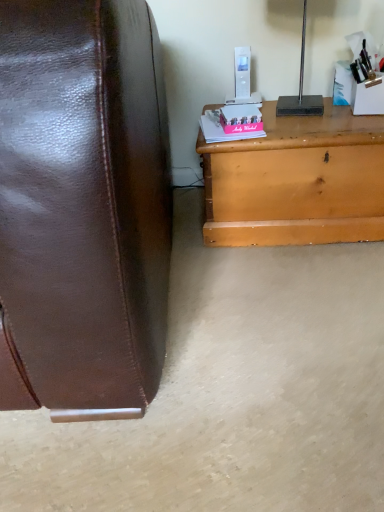
Where is `empty space that is ontop of wooden nightstand at right`? Image resolution: width=384 pixels, height=512 pixels. empty space that is ontop of wooden nightstand at right is located at coordinates (321, 119).